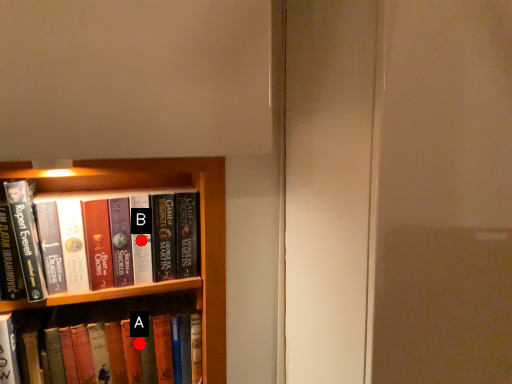
Question: Two points are circled on the image, labeled by A and B beside each circle. Which point is closer to the camera?

Choices:
 (A) A is closer
 (B) B is closer

Answer: (B)